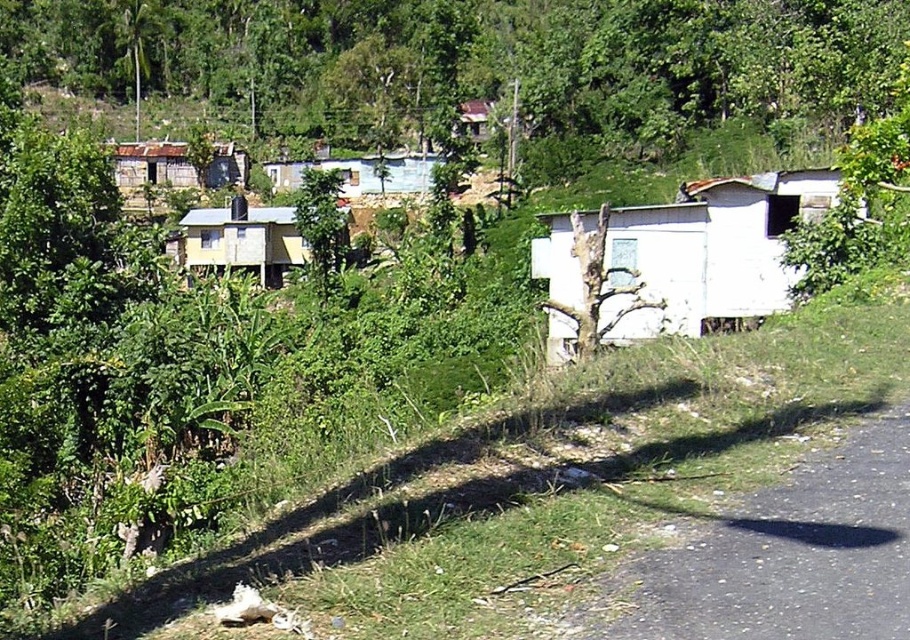
Question: Which point is closer to the camera?

Choices:
 (A) yellow corrugated metal hut at center
 (B) white corrugated metal hut at center-right

Answer: (B)

Question: Is yellow corrugated metal hut at center below rusty corrugated metal hut at center-left?

Choices:
 (A) no
 (B) yes

Answer: (B)

Question: Which of the following is the closest to the observer?

Choices:
 (A) (195, 170)
 (B) (248, 218)

Answer: (B)

Question: Does yellow corrugated metal hut at center lie in front of rusty corrugated metal hut at center-left?

Choices:
 (A) yes
 (B) no

Answer: (A)

Question: Which object is the farthest from the yellow corrugated metal hut at center?

Choices:
 (A) white corrugated metal hut at center-right
 (B) rusty corrugated metal hut at center-left

Answer: (A)

Question: Can you confirm if yellow corrugated metal hut at center is positioned to the left of rusty corrugated metal hut at center-left?

Choices:
 (A) no
 (B) yes

Answer: (A)